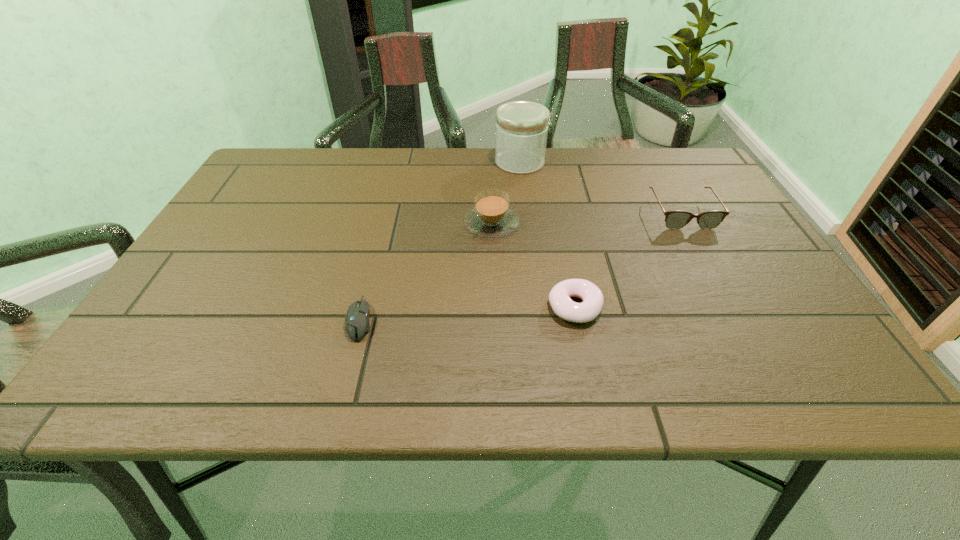
Locate an element on the screen. This screenshot has width=960, height=540. free space located at the front view of the spectacles is located at coordinates (727, 294).

Locate an element on the screen. The image size is (960, 540). vacant area situated 0.320m on the left of the doughnut is located at coordinates (391, 308).

Identify the location of vacant region located on the left of the leftmost object. (302, 319).

The height and width of the screenshot is (540, 960). I want to click on object present at the far edge, so click(521, 126).

Where is `object present at the right edge`? object present at the right edge is located at coordinates (676, 219).

Where is `vacant space at the far edge`? This screenshot has height=540, width=960. vacant space at the far edge is located at coordinates (x=470, y=191).

Find the location of a particular element. This screenshot has width=960, height=540. vacant space at the near edge of the desktop is located at coordinates (218, 367).

Locate an element on the screen. The image size is (960, 540). free space at the right edge is located at coordinates (728, 198).

In the image, there is a desktop. Identify the location of vacant space at the far right corner. (649, 151).

Find the location of a particular element. free space between the shortest object and the fourth shortest object is located at coordinates (426, 271).